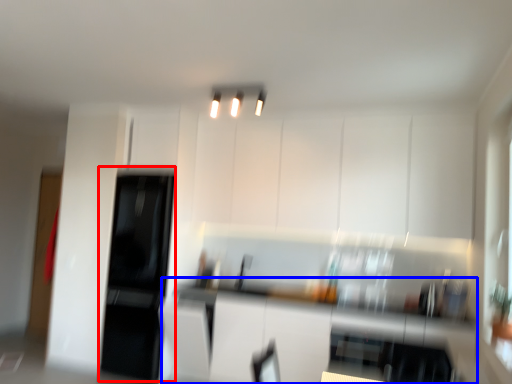
Question: Which point is closer to the camera, appliance (highlighted by a red box) or counter top (highlighted by a blue box)?

Choices:
 (A) appliance
 (B) counter top

Answer: (B)